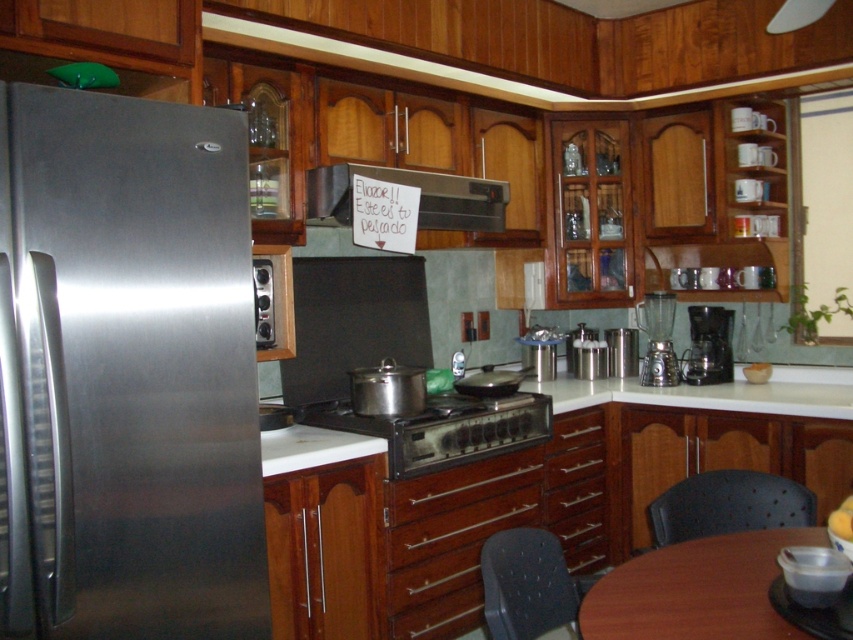
Is metallic silver exhaust hood at upper center smaller than black plastic coffee maker at right?

No.

Can you confirm if metallic silver exhaust hood at upper center is bigger than black plastic coffee maker at right?

Yes, metallic silver exhaust hood at upper center is bigger than black plastic coffee maker at right.

Who is more forward, (x=439, y=220) or (x=727, y=324)?

Positioned in front is point (x=439, y=220).

You are a GUI agent. You are given a task and a screenshot of the screen. Output one action in this format:
    pyautogui.click(x=<x>, y=<y>)
    Task: Click on the metallic silver exhaust hood at upper center
    
    Given the screenshot: What is the action you would take?
    pyautogui.click(x=418, y=202)

Which is behind, point (767, 545) or point (704, 316)?

The point (704, 316) is more distant.

Is brown wooden table at lower right to the right of black plastic coffee maker at right from the viewer's perspective?

In fact, brown wooden table at lower right is to the left of black plastic coffee maker at right.

Does point (769, 612) lie in front of point (686, 362)?

That is True.

Find the location of `brown wooden table at lower right`. brown wooden table at lower right is located at coordinates (695, 589).

Measure the distance between black mesh chair at lower center and black plastic coffee maker at right.

1.90 meters

Can you confirm if black mesh chair at lower center is positioned above black plastic coffee maker at right?

Incorrect, black mesh chair at lower center is not positioned above black plastic coffee maker at right.

Which is behind, point (492, 608) or point (715, 346)?

The point (715, 346) is more distant.

This screenshot has height=640, width=853. I want to click on black mesh chair at lower center, so click(x=527, y=584).